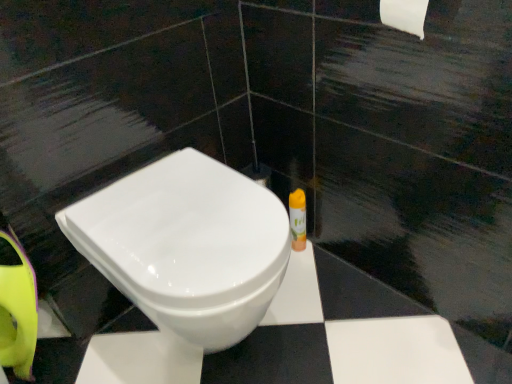
The height and width of the screenshot is (384, 512). Identify the location of white glossy toilet at center. (187, 245).

The width and height of the screenshot is (512, 384). Describe the element at coordinates (187, 245) in the screenshot. I see `white glossy toilet at center` at that location.

From the picture: Measure the distance between point (x=294, y=231) and camera.

A distance of 1.38 meters exists between point (x=294, y=231) and camera.

Locate an element on the screen. yellow plastic spray can at right is located at coordinates (298, 219).

Describe the element at coordinates (298, 219) in the screenshot. The height and width of the screenshot is (384, 512). I see `yellow plastic spray can at right` at that location.

Find the location of a particular element. The width and height of the screenshot is (512, 384). white glossy toilet at center is located at coordinates tap(187, 245).

Between yellow plastic spray can at right and white glossy toilet at center, which one appears on the right side from the viewer's perspective?

yellow plastic spray can at right.

Which object is closer to the camera, yellow plastic spray can at right or white glossy toilet at center?

white glossy toilet at center is more forward.

Is point (298, 240) behind point (204, 178)?

Yes, point (298, 240) is farther from viewer.

From the image's perspective, is yellow plastic spray can at right below white glossy toilet at center?

No, from the image's perspective, yellow plastic spray can at right is not beneath white glossy toilet at center.

From a real-world perspective, does yellow plastic spray can at right stand above white glossy toilet at center?

No, from a real-world perspective, yellow plastic spray can at right is not above white glossy toilet at center.

Is yellow plastic spray can at right wider or thinner than white glossy toilet at center?

yellow plastic spray can at right is thinner than white glossy toilet at center.

Does yellow plastic spray can at right have a lesser height compared to white glossy toilet at center?

Correct, yellow plastic spray can at right is not as tall as white glossy toilet at center.

Does yellow plastic spray can at right have a larger size compared to white glossy toilet at center?

Actually, yellow plastic spray can at right might be smaller than white glossy toilet at center.

Would you say yellow plastic spray can at right is inside or outside white glossy toilet at center?

yellow plastic spray can at right is outside white glossy toilet at center.

Is the surface of yellow plastic spray can at right in direct contact with white glossy toilet at center?

They are not placed beside each other.

Is yellow plastic spray can at right facing away from white glossy toilet at center?

No, yellow plastic spray can at right's orientation is not away from white glossy toilet at center.

Can you tell me how much yellow plastic spray can at right and white glossy toilet at center differ in facing direction?

The angle between the facing direction of yellow plastic spray can at right and the facing direction of white glossy toilet at center is 0.00226 degrees.

Image resolution: width=512 pixels, height=384 pixels. Identify the location of toilet in front of the yellow plastic spray can at right. (187, 245).

Looking at this image, is white glossy toilet at center to the left of yellow plastic spray can at right from the viewer's perspective?

Indeed, white glossy toilet at center is positioned on the left side of yellow plastic spray can at right.

Which object is further away from the camera, white glossy toilet at center or yellow plastic spray can at right?

yellow plastic spray can at right is more distant.

Considering the points (182, 196) and (296, 232), which point is behind, point (182, 196) or point (296, 232)?

The point (296, 232) is farther.

From the image's perspective, between white glossy toilet at center and yellow plastic spray can at right, which one is located above?

yellow plastic spray can at right is shown above in the image.

From a real-world perspective, between white glossy toilet at center and yellow plastic spray can at right, who is vertically lower?

yellow plastic spray can at right is physically lower.

Based on the photo, in terms of width, does white glossy toilet at center look wider or thinner when compared to yellow plastic spray can at right?

Clearly, white glossy toilet at center has more width compared to yellow plastic spray can at right.

Can you confirm if white glossy toilet at center is taller than yellow plastic spray can at right?

Yes, white glossy toilet at center is taller than yellow plastic spray can at right.

In the scene shown: Between white glossy toilet at center and yellow plastic spray can at right, which one has larger size?

white glossy toilet at center.

In the scene shown: Would you say yellow plastic spray can at right is part of white glossy toilet at center's contents?

No, white glossy toilet at center does not contain yellow plastic spray can at right.

Would you say white glossy toilet at center is a long distance from yellow plastic spray can at right?

white glossy toilet at center is near yellow plastic spray can at right, not far away.

Is white glossy toilet at center aimed at yellow plastic spray can at right?

No, white glossy toilet at center is not aimed at yellow plastic spray can at right.

How many degrees apart are the facing directions of white glossy toilet at center and yellow plastic spray can at right?

white glossy toilet at center and yellow plastic spray can at right are facing 0.00226 degrees away from each other.

How far apart are white glossy toilet at center and yellow plastic spray can at right?

A distance of 21.06 inches exists between white glossy toilet at center and yellow plastic spray can at right.

This screenshot has height=384, width=512. I want to click on toilet on the left of yellow plastic spray can at right, so click(187, 245).

I want to click on toiletry lying above the white glossy toilet at center (from the image's perspective), so click(298, 219).

Where is `toiletry below the white glossy toilet at center (from a real-world perspective)`? The height and width of the screenshot is (384, 512). toiletry below the white glossy toilet at center (from a real-world perspective) is located at coordinates (298, 219).